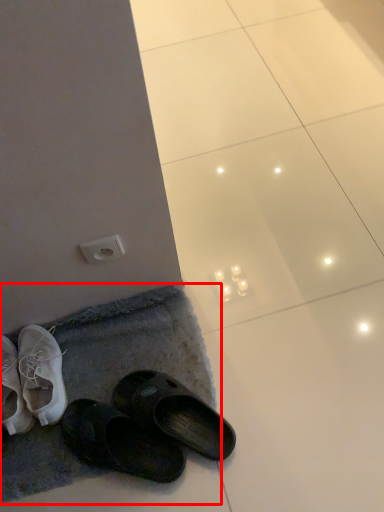
Question: From the image's perspective, what is the correct spatial positioning of bath mat (annotated by the red box) in reference to electric outlet?

Choices:
 (A) below
 (B) above

Answer: (A)